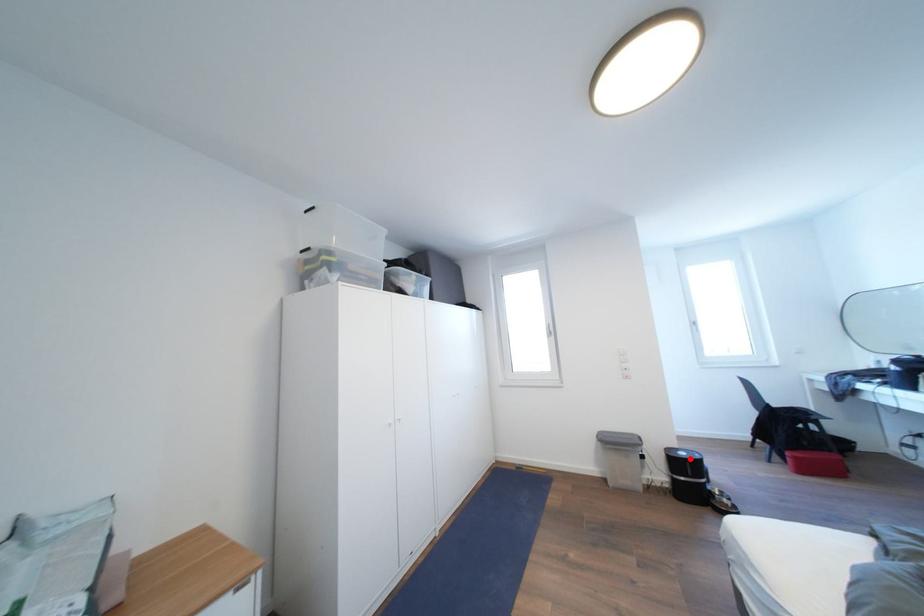
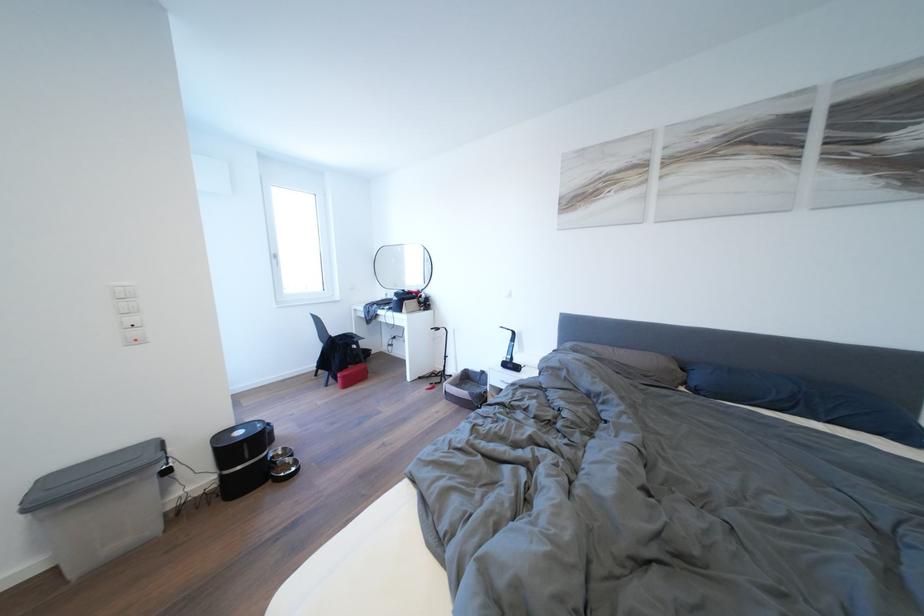
Question: I am providing you with two images of the same scene from different viewpoints. In image1, a red point is highlighted. Considering the same 3D point in image2, which of the following is correct?

Choices:
 (A) It is closer
 (B) It is farther

Answer: (A)